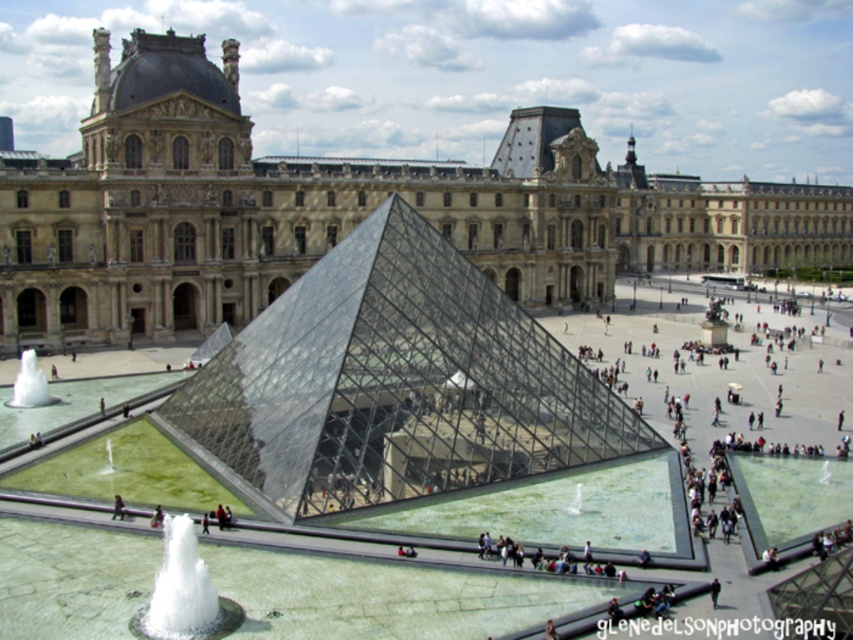
Question: Is white frothy water at center wider than dark brown leather jacket at lower left?

Choices:
 (A) no
 (B) yes

Answer: (B)

Question: Can you confirm if beige stone palace at center is positioned to the left of transparent glass pyramid at center?

Choices:
 (A) yes
 (B) no

Answer: (B)

Question: Which point is farther to the camera?

Choices:
 (A) (135, 632)
 (B) (39, 396)
 (C) (160, 522)

Answer: (B)

Question: Considering the real-world distances, which object is farthest from the dark brown leather jacket at lower left?

Choices:
 (A) transparent glass pyramid at center
 (B) white frothy water at center
 (C) beige stone palace at center
 (D) dark blue fabric at center

Answer: (C)

Question: Does beige stone palace at center have a smaller size compared to dark brown leather jacket at lower left?

Choices:
 (A) yes
 (B) no

Answer: (B)

Question: Which of the following is the closest to the observer?

Choices:
 (A) (115, 515)
 (B) (202, 632)

Answer: (B)